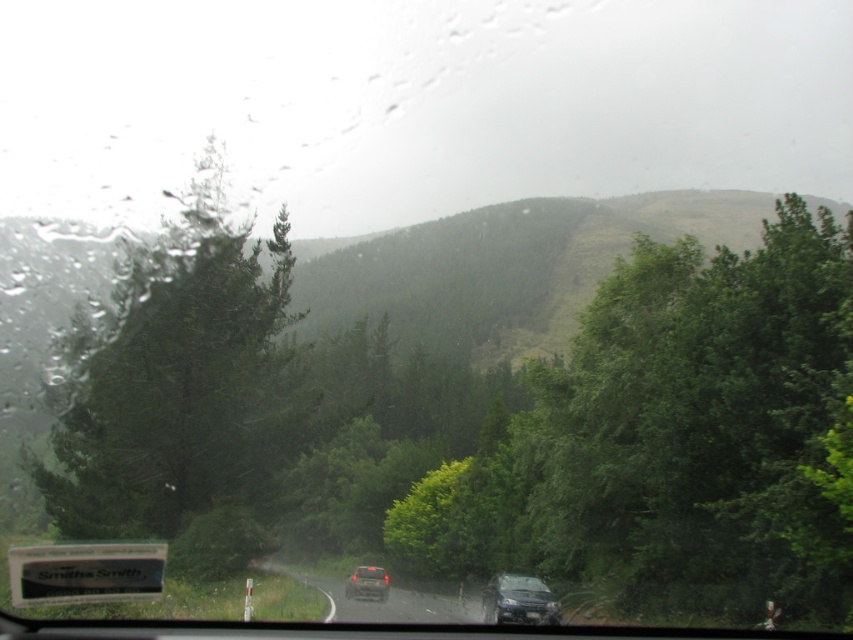
You are driving and see the green textured tree at left represented by point (178, 381). Is the tree closer to the road or the center of the windshield?

The green textured tree at left represented by point (178, 381) is closer to the road since it is positioned at the left side of the road where the vegetation is present.